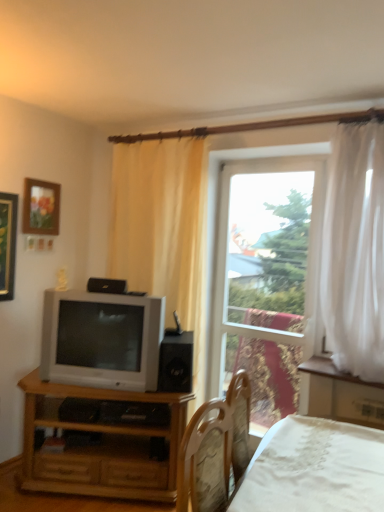
Question: Is white lace bed at lower right not close to light brown wood tv stand at lower left?

Choices:
 (A) no
 (B) yes

Answer: (B)

Question: Is white lace bed at lower right to the left of light brown wood tv stand at lower left from the viewer's perspective?

Choices:
 (A) yes
 (B) no

Answer: (B)

Question: From a real-world perspective, is white lace bed at lower right positioned under light brown wood tv stand at lower left based on gravity?

Choices:
 (A) no
 (B) yes

Answer: (A)

Question: Does white lace bed at lower right have a greater width compared to light brown wood tv stand at lower left?

Choices:
 (A) no
 (B) yes

Answer: (B)

Question: Is white lace bed at lower right smaller than light brown wood tv stand at lower left?

Choices:
 (A) no
 (B) yes

Answer: (B)

Question: Considering the positions of light brown wood tv stand at lower left and wooden framed picture at upper left in the image, is light brown wood tv stand at lower left bigger or smaller than wooden framed picture at upper left?

Choices:
 (A) big
 (B) small

Answer: (A)

Question: Considering the positions of light brown wood tv stand at lower left and wooden framed picture at upper left in the image, is light brown wood tv stand at lower left wider or thinner than wooden framed picture at upper left?

Choices:
 (A) wide
 (B) thin

Answer: (A)

Question: Is light brown wood tv stand at lower left to the left or to the right of wooden framed picture at upper left in the image?

Choices:
 (A) right
 (B) left

Answer: (A)

Question: In terms of height, does light brown wood tv stand at lower left look taller or shorter compared to wooden framed picture at upper left?

Choices:
 (A) short
 (B) tall

Answer: (B)

Question: Considering their positions, is transparent glass window at center located in front of or behind light brown wood tv stand at lower left?

Choices:
 (A) behind
 (B) front

Answer: (A)

Question: From a real-world perspective, is transparent glass window at center above or below light brown wood tv stand at lower left?

Choices:
 (A) below
 (B) above

Answer: (B)

Question: In terms of width, does transparent glass window at center look wider or thinner when compared to light brown wood tv stand at lower left?

Choices:
 (A) wide
 (B) thin

Answer: (B)

Question: Looking at the image, does transparent glass window at center seem bigger or smaller compared to light brown wood tv stand at lower left?

Choices:
 (A) small
 (B) big

Answer: (A)

Question: Considering the positions of light brown wood tv stand at lower left and black matte speaker at center in the image, is light brown wood tv stand at lower left bigger or smaller than black matte speaker at center?

Choices:
 (A) big
 (B) small

Answer: (A)

Question: From a real-world perspective, is light brown wood tv stand at lower left physically located above or below black matte speaker at center?

Choices:
 (A) above
 (B) below

Answer: (B)